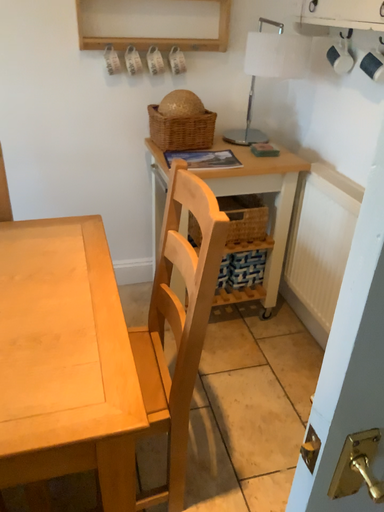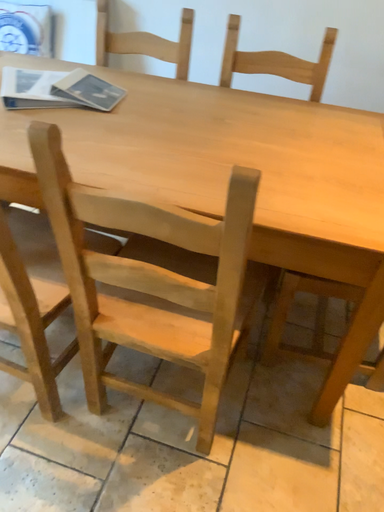
Question: How did the camera likely rotate when shooting the video?

Choices:
 (A) rotated left
 (B) rotated right

Answer: (A)